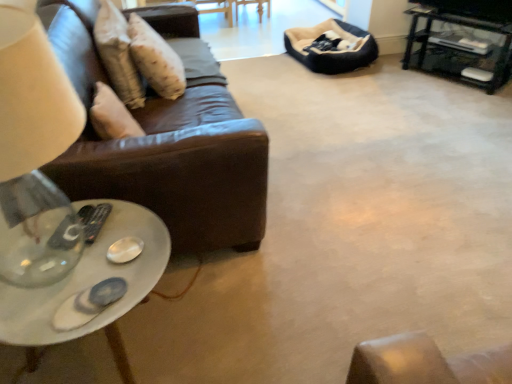
What do you see at coordinates (118, 54) in the screenshot? I see `beige textured pillow at upper left` at bounding box center [118, 54].

Identify the location of black metal tv stand at upper right. Image resolution: width=512 pixels, height=384 pixels. (461, 25).

Looking at this image, is beige textured pillow at upper left positioned with its back to black plastic remote at lower left?

beige textured pillow at upper left does not have its back to black plastic remote at lower left.

Which is correct: beige textured pillow at upper left is inside black plastic remote at lower left, or outside of it?

beige textured pillow at upper left is outside black plastic remote at lower left.

From a real-world perspective, between beige textured pillow at upper left and black plastic remote at lower left, who is vertically higher?

beige textured pillow at upper left, from a real-world perspective.

Considering the sizes of objects beige textured pillow at upper left and black plastic remote at lower left in the image provided, who is shorter, beige textured pillow at upper left or black plastic remote at lower left?

Standing shorter between the two is black plastic remote at lower left.

Is beige textured pillow at upper left completely or partially outside of black metal tv stand at upper right?

Yes, beige textured pillow at upper left is outside of black metal tv stand at upper right.

Between beige textured pillow at upper left and black metal tv stand at upper right, which one has smaller size?

With smaller size is beige textured pillow at upper left.

Is there a large distance between beige textured pillow at upper left and black metal tv stand at upper right?

That's right, there is a large distance between beige textured pillow at upper left and black metal tv stand at upper right.

Can you confirm if white glossy coffee table at lower left is shorter than beige textured pillow at upper left?

Indeed, white glossy coffee table at lower left has a lesser height compared to beige textured pillow at upper left.

Is white glossy coffee table at lower left positioned with its back to beige textured pillow at upper left?

No, beige textured pillow at upper left is not at the back of white glossy coffee table at lower left.

Locate an element on the screen. The height and width of the screenshot is (384, 512). pillow lying behind the white glossy coffee table at lower left is located at coordinates (118, 54).

Which is less distant, (115, 224) or (102, 14)?

The point (115, 224) is in front.

In the scene shown: Does white glossy coffee table at lower left have a greater width compared to black metal tv stand at upper right?

In fact, white glossy coffee table at lower left might be narrower than black metal tv stand at upper right.

Between point (153, 282) and point (407, 42), which one is positioned in front?

The point (153, 282) is more forward.

Would you say white glossy coffee table at lower left is outside black metal tv stand at upper right?

Yes, white glossy coffee table at lower left is located beyond the bounds of black metal tv stand at upper right.

Is white glossy coffee table at lower left facing towards black metal tv stand at upper right?

No, white glossy coffee table at lower left is not facing towards black metal tv stand at upper right.

What's the angular difference between black plastic remote at lower left and dark blue plush bean bag at upper right's facing directions?

148 degrees.

Considering the relative sizes of black plastic remote at lower left and dark blue plush bean bag at upper right in the image provided, is black plastic remote at lower left shorter than dark blue plush bean bag at upper right?

Indeed, black plastic remote at lower left has a lesser height compared to dark blue plush bean bag at upper right.

Can you confirm if black plastic remote at lower left is bigger than dark blue plush bean bag at upper right?

Actually, black plastic remote at lower left might be smaller than dark blue plush bean bag at upper right.

Based on the photo, which point is more distant from viewer, [85,234] or [378,51]?

The point [378,51] is more distant.

Could you measure the distance between transparent glass table lamp at left and white glossy coffee table at lower left?

The distance of transparent glass table lamp at left from white glossy coffee table at lower left is 15.10 centimeters.

Identify the location of table lamp on the left of white glossy coffee table at lower left. This screenshot has width=512, height=384. (34, 155).

From the image's perspective, does transparent glass table lamp at left appear lower than white glossy coffee table at lower left?

No, from the image's perspective, transparent glass table lamp at left is not beneath white glossy coffee table at lower left.

Is white glossy coffee table at lower left a part of transparent glass table lamp at left?

Actually, white glossy coffee table at lower left is outside transparent glass table lamp at left.

Is black plastic remote at lower left turned away from black metal tv stand at upper right?

No, black plastic remote at lower left's orientation is not away from black metal tv stand at upper right.

Are black plastic remote at lower left and black metal tv stand at upper right located far from each other?

Yes.

Between point (87, 206) and point (466, 25), which one is positioned in front?

The point (87, 206) is closer.

Image resolution: width=512 pixels, height=384 pixels. Find the location of `pillow behind the black plastic remote at lower left`. pillow behind the black plastic remote at lower left is located at coordinates (118, 54).

Identify the location of table above the beige textured pillow at upper left (from the image's perspective). (461, 25).

From the image, which object appears to be nearer to black plastic remote at lower left, dark blue plush bean bag at upper right or white glossy coffee table at lower left?

white glossy coffee table at lower left.

From the image, which object appears to be nearer to beige textured pillow at upper left, black plastic remote at lower left or white glossy coffee table at lower left?

black plastic remote at lower left.

When comparing their distances from beige textured pillow at upper left, does black metal tv stand at upper right or transparent glass table lamp at left seem closer?

Among the two, transparent glass table lamp at left is located nearer to beige textured pillow at upper left.

Which object lies further to the anchor point beige textured pillow at upper left, black metal tv stand at upper right or black plastic remote at lower left?

black metal tv stand at upper right is further to beige textured pillow at upper left.

From the image, which object appears to be nearer to black metal tv stand at upper right, white glossy coffee table at lower left or dark blue plush bean bag at upper right?

The object closer to black metal tv stand at upper right is dark blue plush bean bag at upper right.

From the image, which object appears to be farther from dark blue plush bean bag at upper right, white glossy coffee table at lower left or transparent glass table lamp at left?

Based on the image, transparent glass table lamp at left appears to be further to dark blue plush bean bag at upper right.

Based on their spatial positions, is white glossy coffee table at lower left or transparent glass table lamp at left closer to black metal tv stand at upper right?

white glossy coffee table at lower left lies closer to black metal tv stand at upper right than the other object.

From the picture: When comparing their distances from transparent glass table lamp at left, does dark blue plush bean bag at upper right or beige textured pillow at upper left seem further?

The object further to transparent glass table lamp at left is dark blue plush bean bag at upper right.

Where is `remote between white glossy coffee table at lower left and black metal tv stand at upper right from left to right`? remote between white glossy coffee table at lower left and black metal tv stand at upper right from left to right is located at coordinates (96, 221).

You are a GUI agent. You are given a task and a screenshot of the screen. Output one action in this format:
    pyautogui.click(x=<x>, y=<y>)
    Task: Click on the table lamp located between beige textured pillow at upper left and black metal tv stand at upper right in the left-right direction
    The height and width of the screenshot is (384, 512).
    Given the screenshot: What is the action you would take?
    pyautogui.click(x=34, y=155)

Find the location of a particular element. This screenshot has height=384, width=512. bean bag chair situated between black plastic remote at lower left and black metal tv stand at upper right from left to right is located at coordinates (333, 51).

Where is `remote located between transparent glass table lamp at left and dark blue plush bean bag at upper right in the depth direction`? remote located between transparent glass table lamp at left and dark blue plush bean bag at upper right in the depth direction is located at coordinates (96, 221).